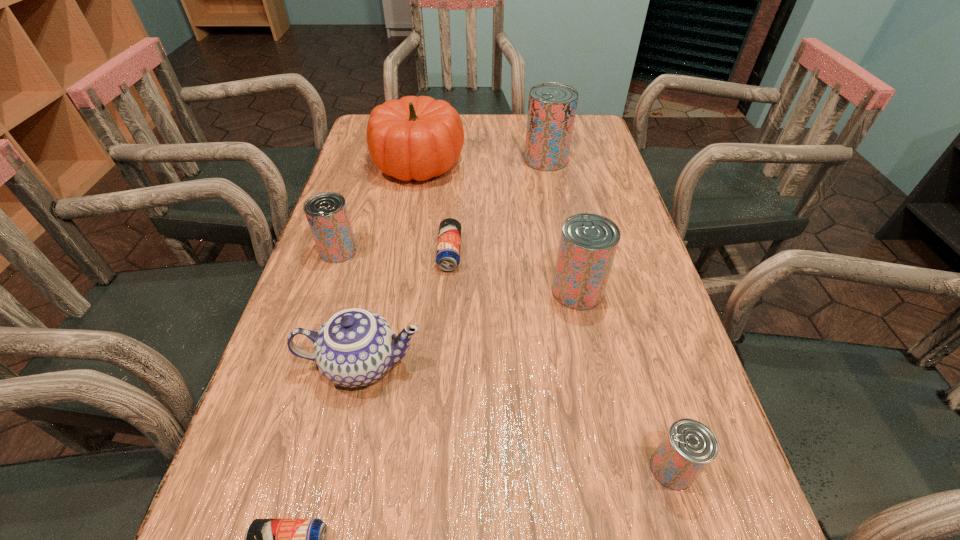
Image resolution: width=960 pixels, height=540 pixels. In order to click on free region at the far right corner of the desktop in this screenshot , I will do `click(584, 131)`.

At what (x,y) coordinates should I click in order to perform the action: click on free space between the pumpkin and the rightmost object. Please return your answer as a coordinate pair (x, y). Looking at the image, I should click on (545, 316).

Identify the location of vacant region between the sixth tallest object and the second biggest red beer can. (625, 380).

Identify the location of free area in between the pumpkin and the third smallest red beer can. (498, 227).

Identify the location of vacant point located between the rightmost beer can and the right blue beer can. (561, 361).

Identify the location of free space between the rightmost beer can and the second tallest beer can. This screenshot has width=960, height=540. (625, 380).

Find the location of a particular element. Image resolution: width=960 pixels, height=540 pixels. object that stands as the seventh closest to the pumpkin is located at coordinates (265, 539).

Point out which object is positioned as the sixth nearest to the second shortest object. Please provide its 2D coordinates. Your answer should be formatted as a tuple, i.e. [(x, y)], where the tuple contains the x and y coordinates of a point satisfying the conditions above.

[(689, 446)]

Where is `the second closest beer can relative to the pumpkin`? The width and height of the screenshot is (960, 540). the second closest beer can relative to the pumpkin is located at coordinates (449, 237).

Find the location of a particular element. The image size is (960, 540). beer can that can be found as the third closest to the nearest object is located at coordinates (327, 214).